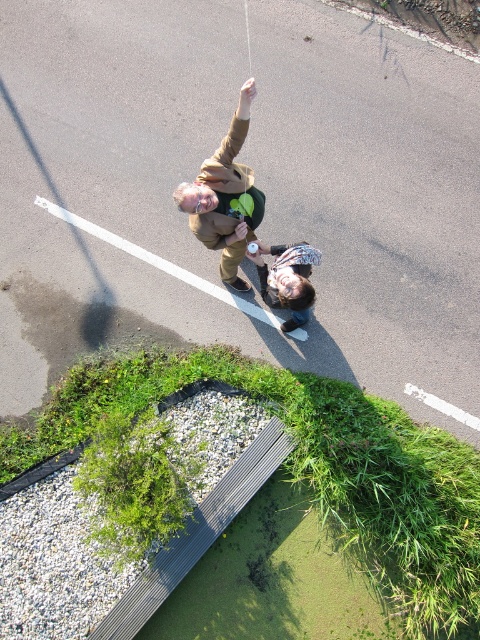
Question: Is green grass at lower left thinner than brown suede jacket at upper center?

Choices:
 (A) no
 (B) yes

Answer: (A)

Question: Is brown suede jacket at upper center to the left of matte brown jacket at center from the viewer's perspective?

Choices:
 (A) no
 (B) yes

Answer: (B)

Question: Can you confirm if brown suede jacket at upper center is positioned to the left of matte brown jacket at center?

Choices:
 (A) no
 (B) yes

Answer: (B)

Question: Which object is closer to the camera taking this photo?

Choices:
 (A) matte brown jacket at center
 (B) green grass at lower left

Answer: (A)

Question: Which of these objects is positioned closest to the green grass at lower left?

Choices:
 (A) matte brown jacket at center
 (B) brown suede jacket at upper center

Answer: (A)

Question: Which point appears closest to the camera in this image?

Choices:
 (A) (226, 136)
 (B) (17, 454)

Answer: (B)